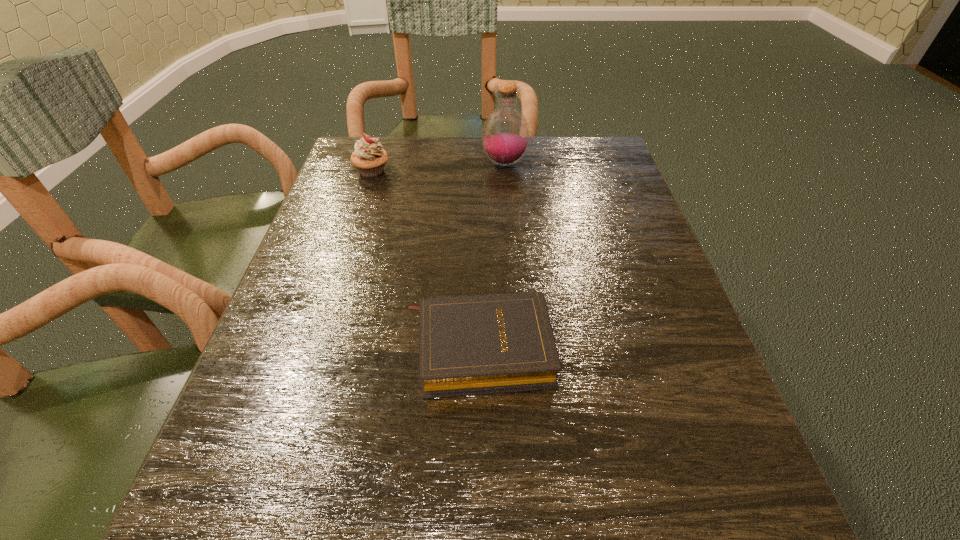
You are a GUI agent. You are given a task and a screenshot of the screen. Output one action in this format:
    pyautogui.click(x=<x>, y=<y>)
    Task: Click on the bottle
    
    Given the screenshot: What is the action you would take?
    pyautogui.click(x=505, y=136)

This screenshot has width=960, height=540. What are the coordinates of `cupcake` in the screenshot? It's located at (369, 158).

The width and height of the screenshot is (960, 540). Identify the location of the leftmost object. (369, 158).

Identify the location of the nearest object. Image resolution: width=960 pixels, height=540 pixels. (468, 345).

Image resolution: width=960 pixels, height=540 pixels. I want to click on Bible, so click(468, 345).

Find the location of a particular element. This screenshot has height=540, width=960. vacant space located 0.170m on the left of the bottle is located at coordinates pyautogui.click(x=414, y=164).

Where is `free space located on the right of the cupcake`? The image size is (960, 540). free space located on the right of the cupcake is located at coordinates (427, 171).

I want to click on free point located on the back of the nearest object, so click(x=479, y=237).

Image resolution: width=960 pixels, height=540 pixels. Identify the location of bottle that is at the far edge. (505, 136).

Where is `cupcake located at the far edge`? Image resolution: width=960 pixels, height=540 pixels. cupcake located at the far edge is located at coordinates (369, 158).